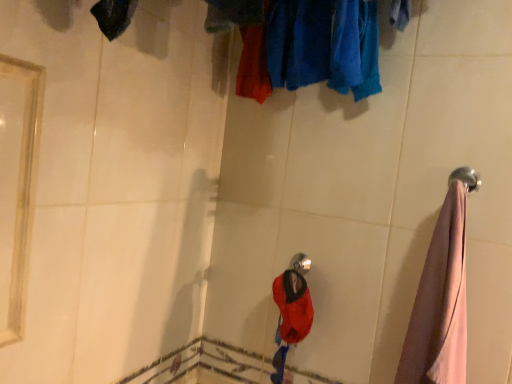
Question: Is shiny metallic shower head at center directly adjacent to velvet-like red hat at center?

Choices:
 (A) yes
 (B) no

Answer: (B)

Question: Is shiny metallic shower head at center positioned beyond the bounds of velvet-like red hat at center?

Choices:
 (A) yes
 (B) no

Answer: (A)

Question: Does shiny metallic shower head at center have a lesser height compared to velvet-like red hat at center?

Choices:
 (A) yes
 (B) no

Answer: (A)

Question: Is the position of shiny metallic shower head at center more distant than that of velvet-like red hat at center?

Choices:
 (A) yes
 (B) no

Answer: (A)

Question: Can you confirm if shiny metallic shower head at center is wider than velvet-like red hat at center?

Choices:
 (A) no
 (B) yes

Answer: (A)

Question: Is shiny metallic shower head at center oriented away from velvet-like red hat at center?

Choices:
 (A) yes
 (B) no

Answer: (B)

Question: Is pink fabric towel at right in front of shiny metallic shower head at center?

Choices:
 (A) no
 (B) yes

Answer: (B)

Question: Would you consider pink fabric towel at right to be distant from shiny metallic shower head at center?

Choices:
 (A) no
 (B) yes

Answer: (A)

Question: Is pink fabric towel at right outside of shiny metallic shower head at center?

Choices:
 (A) yes
 (B) no

Answer: (A)

Question: Does pink fabric towel at right have a lesser width compared to shiny metallic shower head at center?

Choices:
 (A) no
 (B) yes

Answer: (A)

Question: Considering the relative sizes of pink fabric towel at right and shiny metallic shower head at center in the image provided, is pink fabric towel at right wider than shiny metallic shower head at center?

Choices:
 (A) yes
 (B) no

Answer: (A)

Question: Considering the relative positions of pink fabric towel at right and shiny metallic shower head at center in the image provided, is pink fabric towel at right to the left of shiny metallic shower head at center from the viewer's perspective?

Choices:
 (A) yes
 (B) no

Answer: (B)

Question: Is shiny metallic shower head at center to the right of pink fabric towel at right from the viewer's perspective?

Choices:
 (A) yes
 (B) no

Answer: (B)